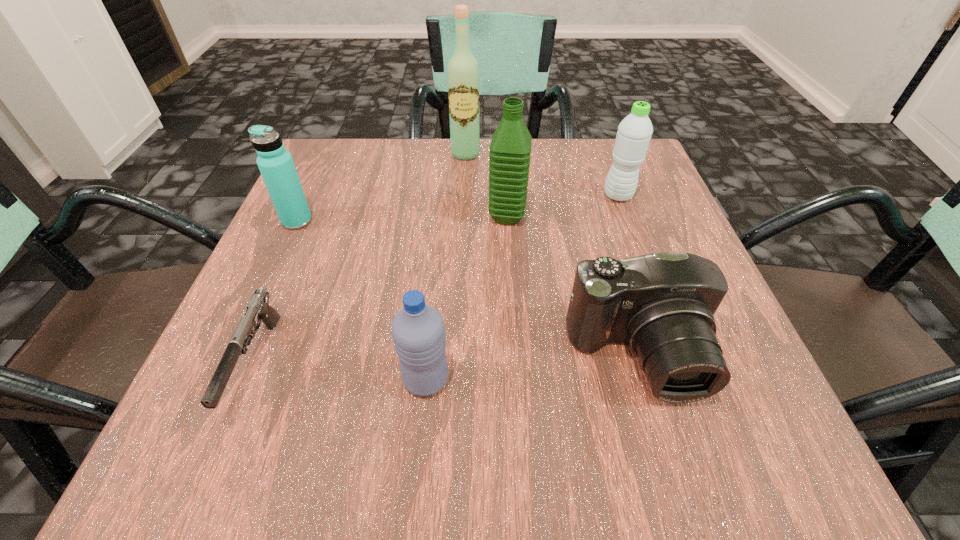
Locate an element on the screen. This screenshot has height=540, width=960. the farthest object is located at coordinates (463, 71).

This screenshot has height=540, width=960. Find the location of `the tallest object`. the tallest object is located at coordinates (463, 71).

I want to click on the second tallest object, so click(510, 149).

The height and width of the screenshot is (540, 960). I want to click on the second water bottle from right to left, so click(510, 149).

Find the location of a particular element. The image size is (960, 540). the farthest water bottle is located at coordinates (634, 132).

You are a GUI agent. You are given a task and a screenshot of the screen. Output one action in this format:
    pyautogui.click(x=<x>, y=<y>)
    Task: Click on the second farthest object
    Image resolution: width=960 pixels, height=540 pixels.
    Given the screenshot: What is the action you would take?
    pyautogui.click(x=634, y=132)

Identify the location of the leftmost water bottle. (276, 165).

Image resolution: width=960 pixels, height=540 pixels. What are the coordinates of `the second water bottle from left to right` in the screenshot? It's located at (418, 331).

Locate an element on the screen. This screenshot has width=960, height=540. camera is located at coordinates pyautogui.click(x=663, y=304).

Find the location of a particular element. The height and width of the screenshot is (540, 960). gun is located at coordinates (258, 308).